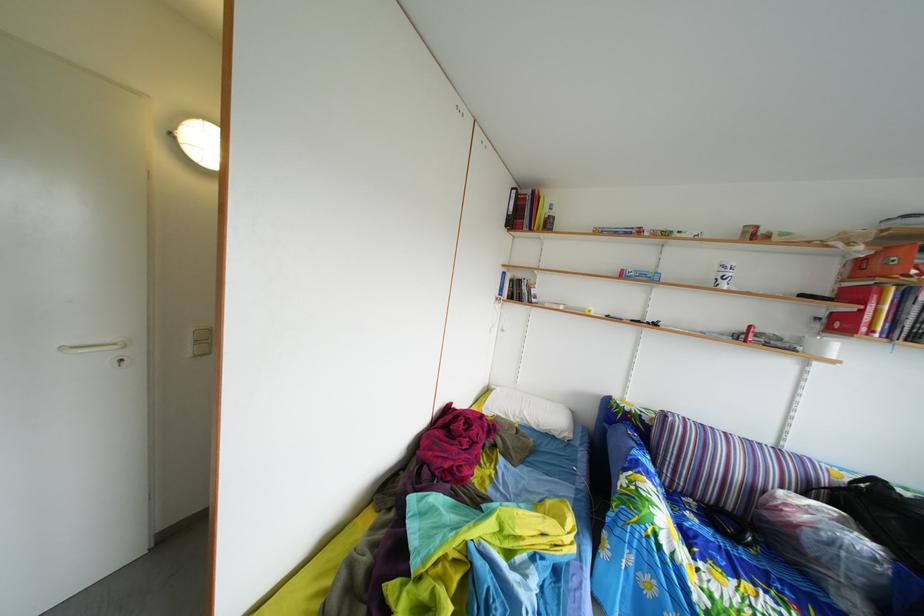
Find where to pull the white door handle. Please return your answer as a coordinate pair (x, y).

(92, 347)